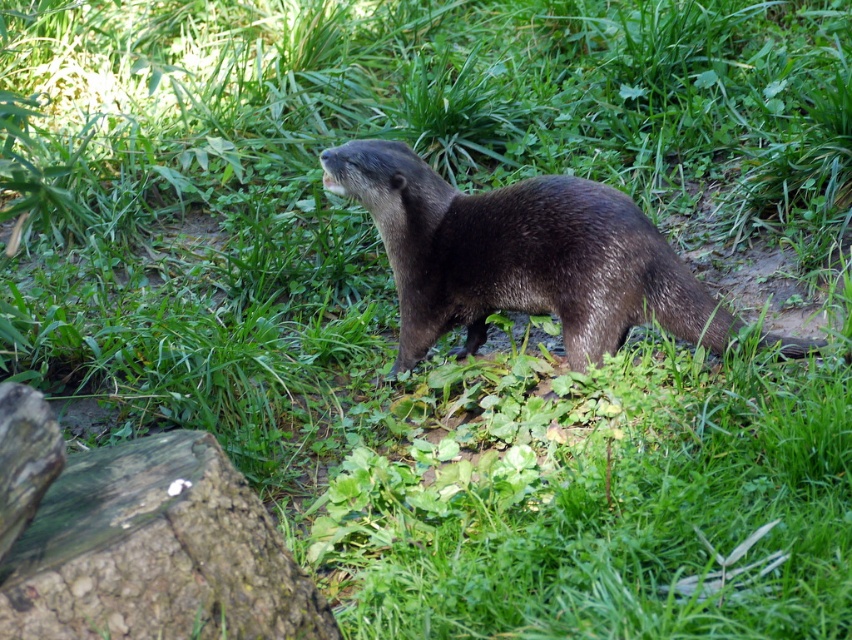
Who is lower down, shiny brown otter at center or weathered brown log at lower left?

→ Positioned lower is weathered brown log at lower left.

Between point (577, 240) and point (263, 588), which one is positioned behind?

The point (577, 240) is behind.

Identify the location of shiny brown otter at center. [x=521, y=257].